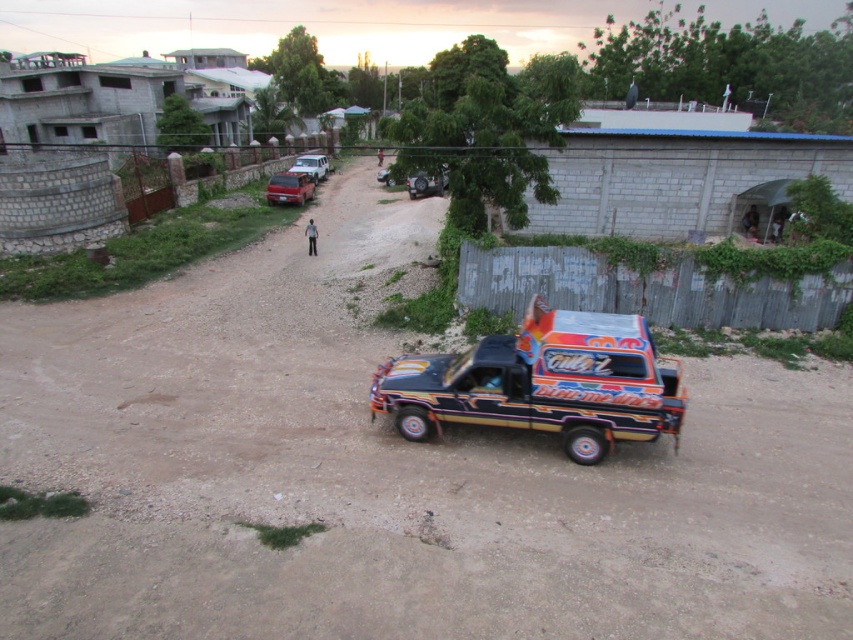
Can you confirm if painted wood monster truck at center is thinner than white matte car at upper center?

No.

How much distance is there between painted wood monster truck at center and white matte car at upper center?

They are 32.91 meters apart.

At what (x,y) coordinates should I click in order to perform the action: click on painted wood monster truck at center. Please return your answer as a coordinate pair (x, y). Looking at the image, I should click on (543, 384).

Who is higher up, painted wood monster truck at center or metallic red car at upper left?

metallic red car at upper left

Describe the element at coordinates (543, 384) in the screenshot. This screenshot has height=640, width=853. I see `painted wood monster truck at center` at that location.

Locate an element on the screen. This screenshot has width=853, height=640. painted wood monster truck at center is located at coordinates (543, 384).

Who is taller, metallic red car at upper left or white matte car at upper center?

With more height is white matte car at upper center.

Is metallic red car at upper left shorter than white matte car at upper center?

Yes, metallic red car at upper left is shorter than white matte car at upper center.

Which is in front, point (294, 193) or point (306, 161)?

Positioned in front is point (294, 193).

You are a GUI agent. You are given a task and a screenshot of the screen. Output one action in this format:
    pyautogui.click(x=<x>, y=<y>)
    Task: Click on the metallic red car at upper left
    
    Given the screenshot: What is the action you would take?
    pyautogui.click(x=289, y=188)